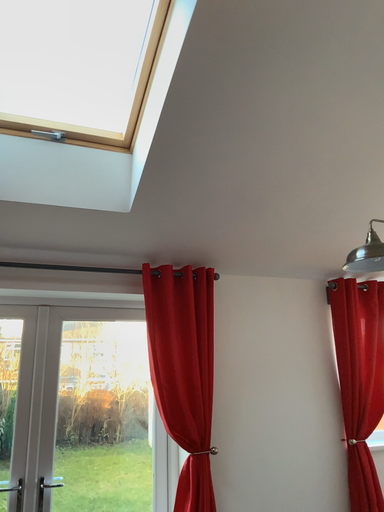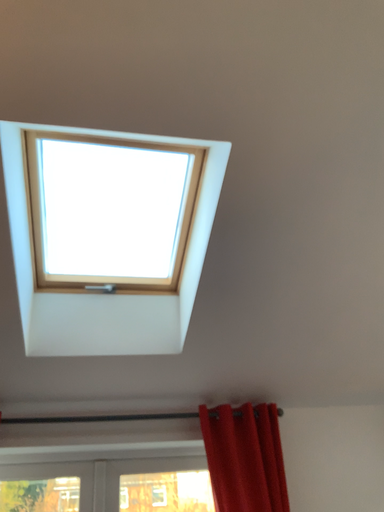
Question: How did the camera likely rotate when shooting the video?

Choices:
 (A) rotated left
 (B) rotated right

Answer: (A)